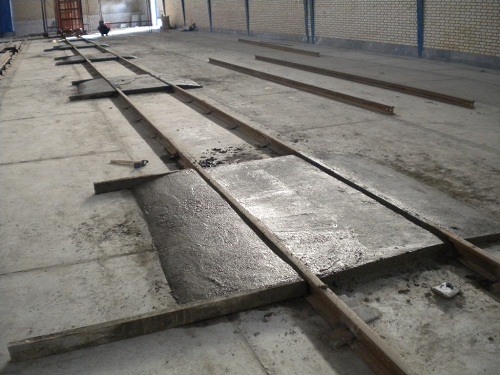
You are a GUI agent. You are given a task and a screenshot of the screen. Output one action in this format:
    pyautogui.click(x=<x>, y=<y>)
    Task: Click on the concrete floor
    The width and height of the screenshot is (500, 375).
    Given the screenshot: What is the action you would take?
    pyautogui.click(x=67, y=235), pyautogui.click(x=186, y=123), pyautogui.click(x=281, y=117)